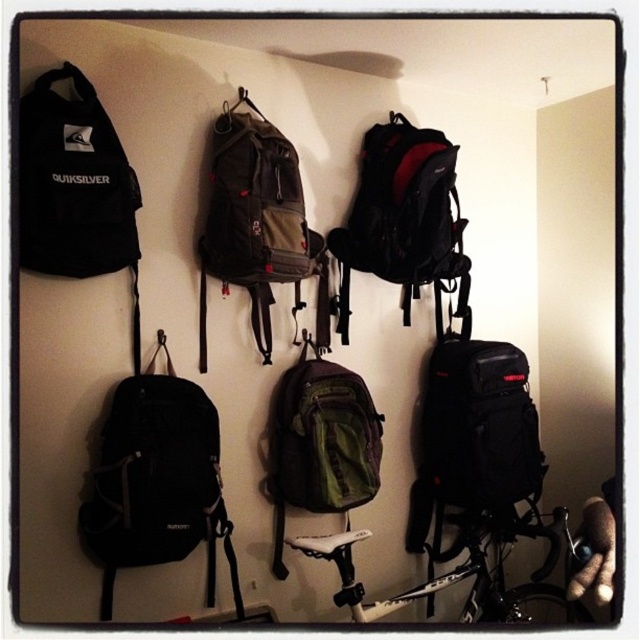
You are organizing a storage wall and need to place a new item between the matte black backpack at center and the green fabric backpack at center. Based on their positions, which backpack should the new item be placed to the left of?

The new item should be placed to the left of the matte black backpack at center because the matte black backpack at center is to the right of the green fabric backpack at center.

Consider the image. You are standing in front of a wall with several backpacks and a bicycle. There is a specific point on the wall at coordinates point (x=364, y=253). If you want to place a new backpack that is 2 feet wide, will there be enough space between you and that point to hang it?

The distance between you and point (x=364, y=253) is 7.16 feet, which is more than enough space to hang a 2 feet wide backpack.

You are trying to decide whether to hang a new small backpack between the camouflage fabric backpack at center and the shiny silver bicycle at lower center. Based on their sizes, will there be enough vertical space between them to fit the new backpack?

The camouflage fabric backpack at center is taller than the shiny silver bicycle at lower center, so there might be enough vertical space between them to fit a new small backpack.